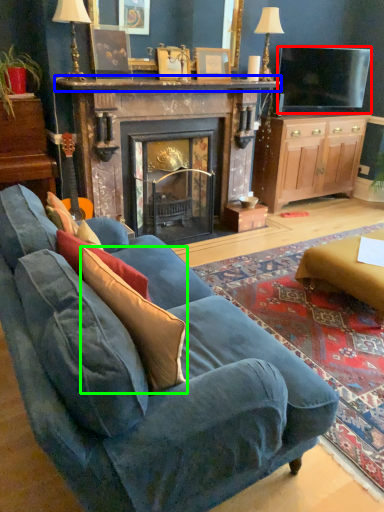
Question: Based on their relative distances, which object is nearer to television (highlighted by a red box)? Choose from mantle (highlighted by a blue box) and throw pillow (highlighted by a green box).

Choices:
 (A) mantle
 (B) throw pillow

Answer: (A)